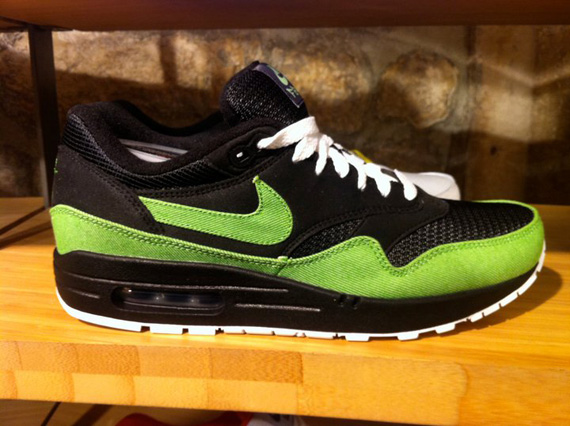
The width and height of the screenshot is (570, 426). Identify the location of wall. (401, 100).